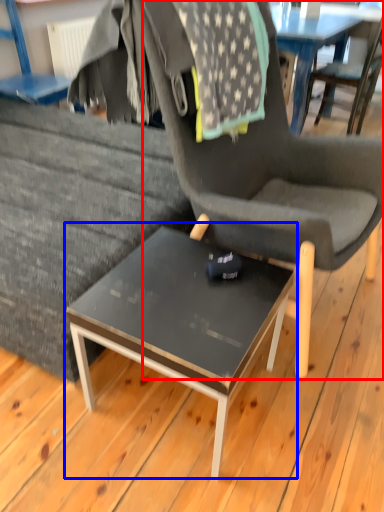
Question: Among these objects, which one is farthest to the camera, chair (highlighted by a red box) or coffee table (highlighted by a blue box)?

Choices:
 (A) chair
 (B) coffee table

Answer: (B)